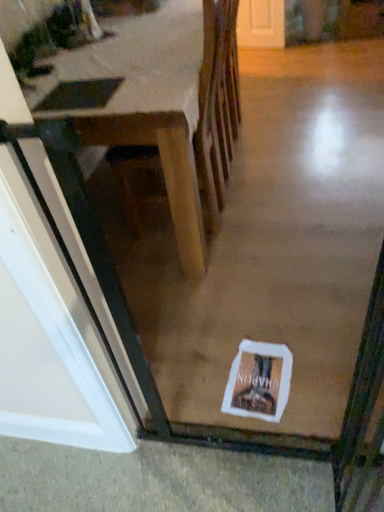
Image resolution: width=384 pixels, height=512 pixels. I want to click on vacant space to the right of white paper postcard at center, so click(x=317, y=370).